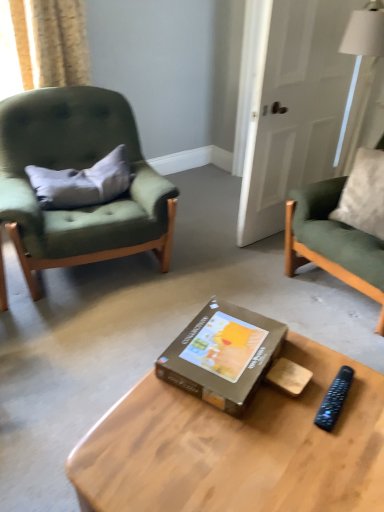
The height and width of the screenshot is (512, 384). Find the location of `vacant area to the right of brown cardboard box at center`. vacant area to the right of brown cardboard box at center is located at coordinates (329, 382).